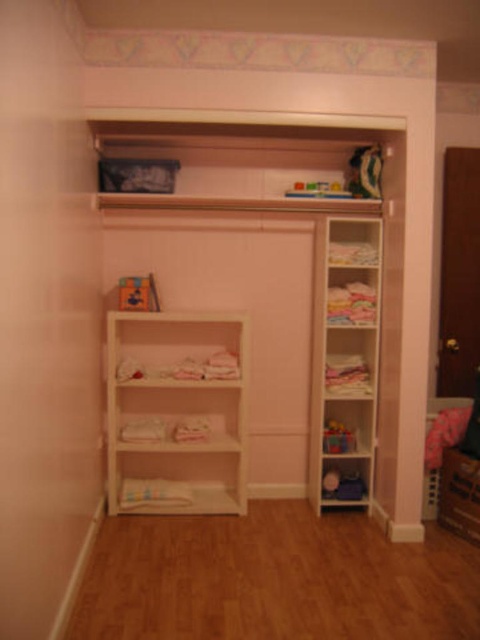
Between wooden block at center and plastic colorful toy at center, which one appears on the right side from the viewer's perspective?

plastic colorful toy at center

Is wooden block at center closer to camera compared to plastic colorful toy at center?

Yes, it is.

Measure the distance between point (153, 278) and camera.

A distance of 3.27 meters exists between point (153, 278) and camera.

Find the location of a particular element. wooden block at center is located at coordinates (137, 292).

Is point (230, 436) positioned behind point (119, 278)?

Yes, it is.

Is point (108, 358) in front of point (134, 308)?

Yes, it is in front of point (134, 308).

Is point (151, 477) farther from camera compared to point (123, 308)?

Yes, point (151, 477) is farther from viewer.

Locate an element on the screen. The width and height of the screenshot is (480, 640). white matte bookshelf at center is located at coordinates (176, 412).

Can you confirm if white matte bookshelf at center is thinner than green plush toy at upper right?

No, white matte bookshelf at center is not thinner than green plush toy at upper right.

Where is `white matte bookshelf at center`? white matte bookshelf at center is located at coordinates (176, 412).

At what (x,y) coordinates should I click in order to perform the action: click on white matte bookshelf at center. Please return your answer as a coordinate pair (x, y). The image size is (480, 640). Looking at the image, I should click on (176, 412).